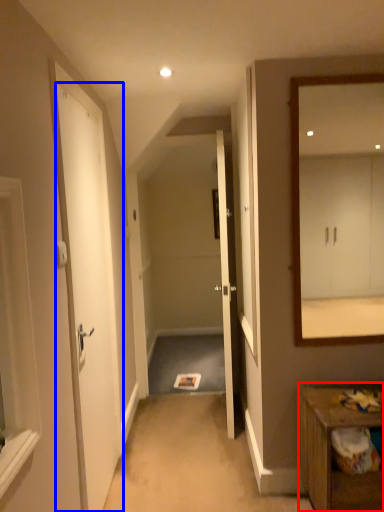
Question: Which point is closer to the camera, table (highlighted by a red box) or door (highlighted by a blue box)?

Choices:
 (A) table
 (B) door

Answer: (B)